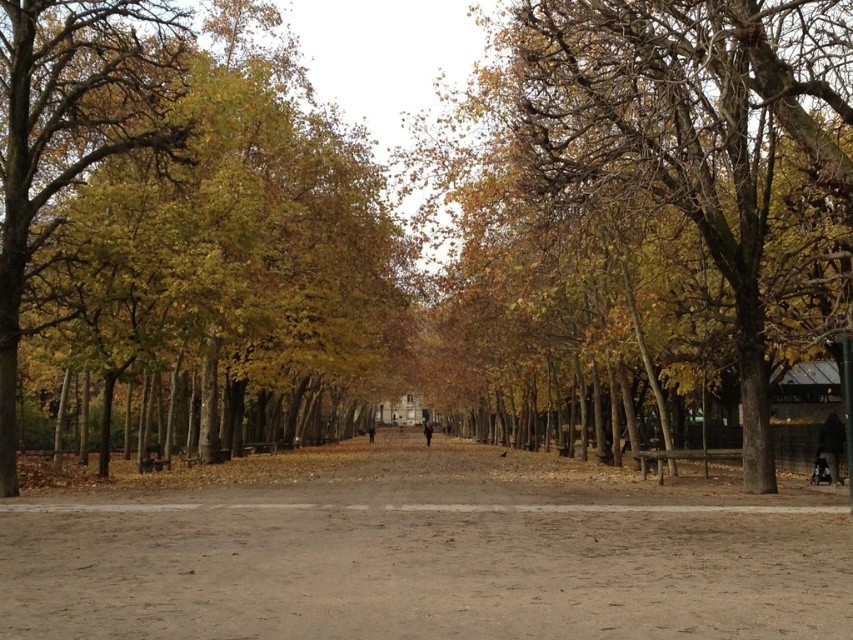
You are standing in the park and want to take a photo of both the point at coordinates (753, 625) and the point at coordinates (498, 307). Which point should you focus on first to ensure both are in focus?

You should focus on the point at coordinates (498, 307) first because it is farther away from the viewer than the point at coordinates (753, 625). By focusing on the farther point, both points will be in focus due to the depth of field.